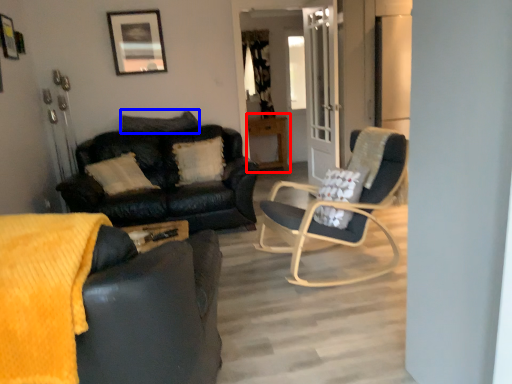
Question: Which point is further to the camera, table (highlighted by a red box) or pillow (highlighted by a blue box)?

Choices:
 (A) table
 (B) pillow

Answer: (A)